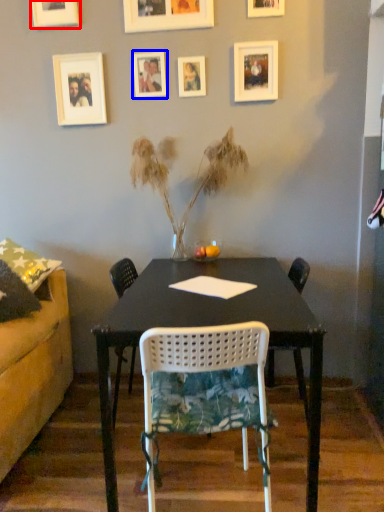
Question: Which object appears closest to the camera in this image, picture frame (highlighted by a red box) or picture frame (highlighted by a blue box)?

Choices:
 (A) picture frame
 (B) picture frame

Answer: (A)